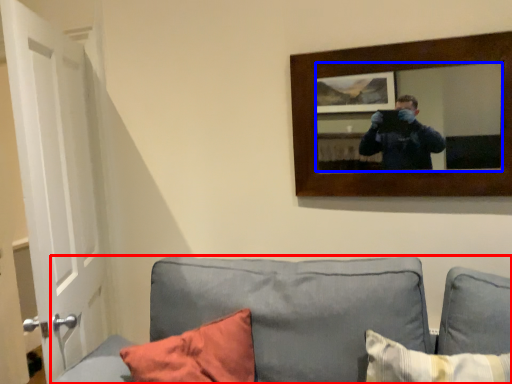
Question: Which point is further to the camera, studio couch (highlighted by a red box) or mirror (highlighted by a blue box)?

Choices:
 (A) studio couch
 (B) mirror

Answer: (B)